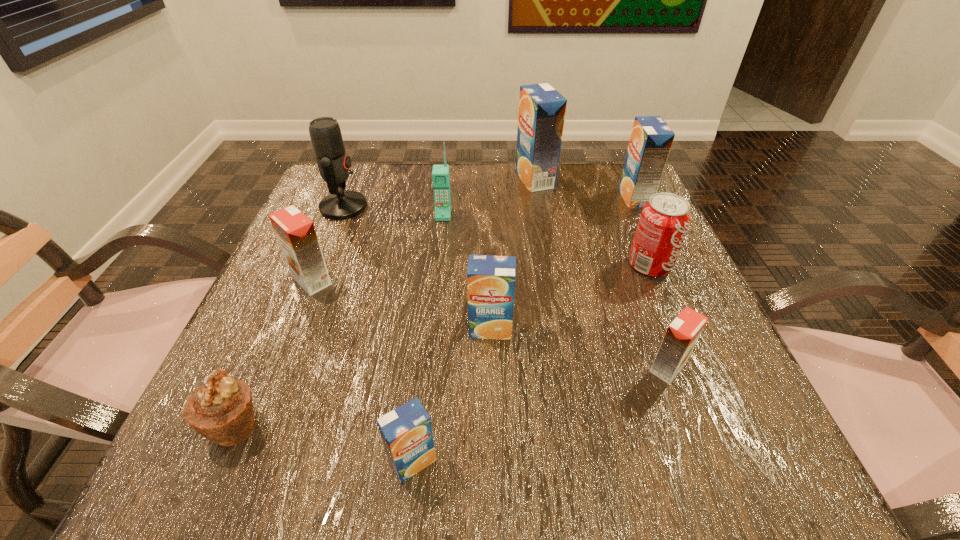
I want to click on the tallest orange_juice, so point(542,109).

Find the location of `the fourth orange_juice from left to right`. the fourth orange_juice from left to right is located at coordinates (542, 109).

Where is `red microphone`? red microphone is located at coordinates (333, 163).

Where is `the third smallest blue orange_juice`? the third smallest blue orange_juice is located at coordinates (651, 139).

This screenshot has height=540, width=960. I want to click on the rightmost blue orange_juice, so click(x=651, y=139).

Where is `cellular telephone`? The height and width of the screenshot is (540, 960). cellular telephone is located at coordinates (440, 173).

Identify the location of soda. This screenshot has height=540, width=960. (664, 221).

Identify the location of the leftmost orange_juice. (296, 234).

Locate an element on the screen. the third farthest orange_juice is located at coordinates (296, 234).

This screenshot has height=540, width=960. Find the location of `the fourth orange_juice from right to left`. the fourth orange_juice from right to left is located at coordinates (490, 279).